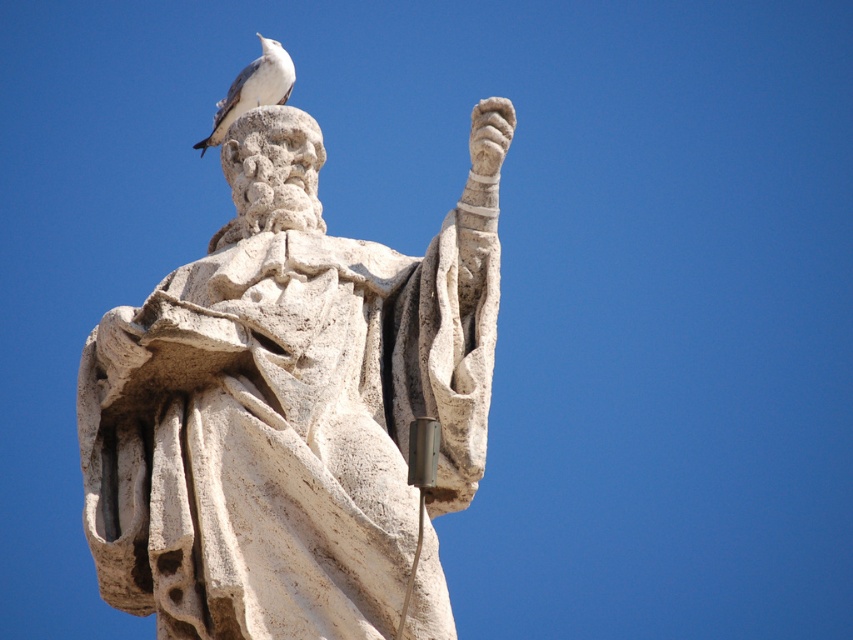
Question: Is white stone statue at center smaller than white stone bird at top?

Choices:
 (A) no
 (B) yes

Answer: (B)

Question: Is white stone statue at center bigger than white stone bird at top?

Choices:
 (A) yes
 (B) no

Answer: (B)

Question: Can you confirm if white stone statue at center is wider than white stone bird at top?

Choices:
 (A) yes
 (B) no

Answer: (A)

Question: Which object appears farthest from the camera in this image?

Choices:
 (A) white stone statue at center
 (B) white stone bird at top

Answer: (B)